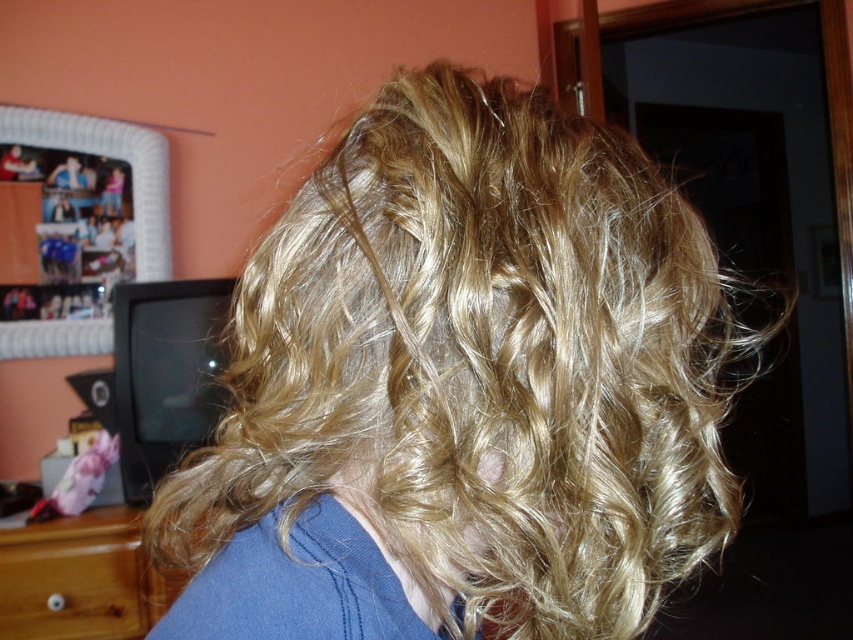
You are a photographer setting up for a portrait. You notice the blonde curly hair at center and the wooden dresser at lower left in the frame. Which object is closer to the camera?

The blonde curly hair at center is closer to the camera because it is in front of the wooden dresser at lower left.

You are an interior designer working on a project and need to place a decorative item exactly at the center of the room. The scene has a blonde curly hair at center. Where should you place the item?

The blonde curly hair at center is located at point (461, 388), so you should place the decorative item at that coordinate to center it in the room.